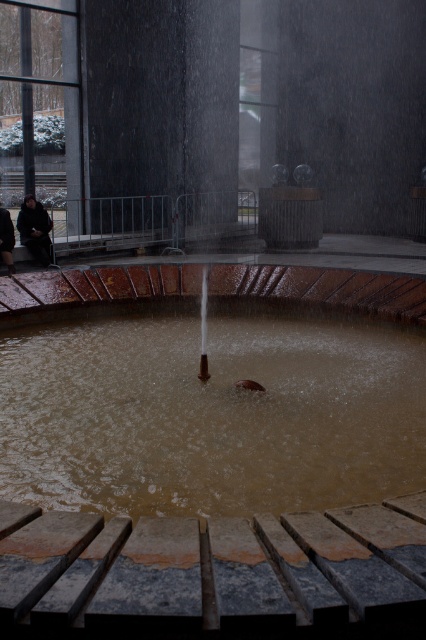
Looking at this image, you are a security guard patrolling the area and notice the brown matte water at center and the dark brown leather jacket at left. Which object takes up more space in the scene?

The brown matte water at center has a larger size compared to the dark brown leather jacket at left, so it takes up more space in the scene.

You are standing on the raised platform around the water feature and need to move to the other side. There is a black polished stone pillar at upper center and a dark gray coat at left in your way. Which obstacle takes up more space that you need to navigate around?

The dark gray coat at left takes up more space than the black polished stone pillar at upper center, so you need to navigate around it more carefully.

Consider the image. You are standing at the edge of the water feature and want to walk to the point marked at coordinates point (305, 493) and point (48, 256). Which point is closer to you?

Point (305, 493) is closer to the viewer than point (48, 256), so you will reach point (305, 493) first.